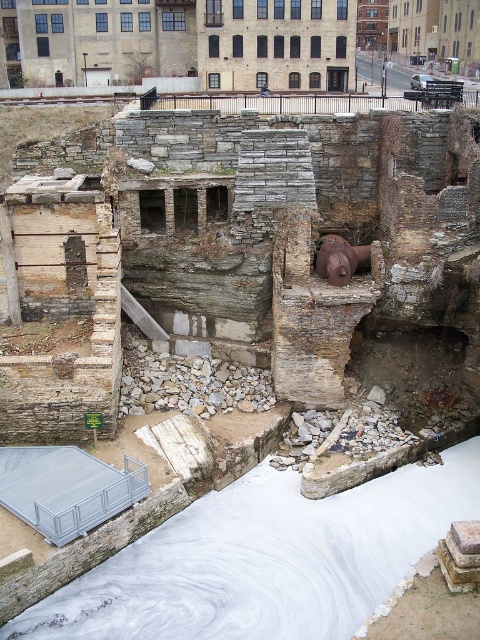
Does rusty stone ruins at center have a smaller size compared to white smooth water at center?

Incorrect, rusty stone ruins at center is not smaller in size than white smooth water at center.

Can you confirm if rusty stone ruins at center is positioned below white smooth water at center?

No, rusty stone ruins at center is not below white smooth water at center.

What do you see at coordinates (240, 248) in the screenshot? I see `rusty stone ruins at center` at bounding box center [240, 248].

Identify the location of rusty stone ruins at center. The height and width of the screenshot is (640, 480). (240, 248).